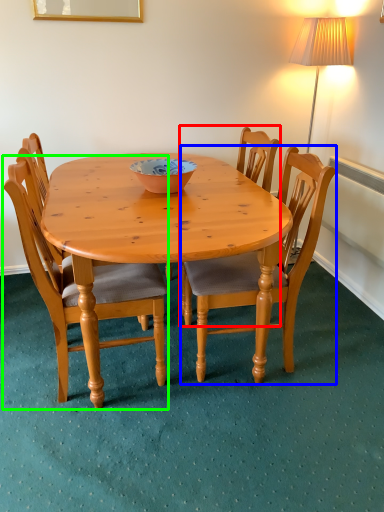
Question: Which object is positioned farthest from chair (highlighted by a red box)? Select from chair (highlighted by a blue box) and chair (highlighted by a green box).

Choices:
 (A) chair
 (B) chair

Answer: (B)